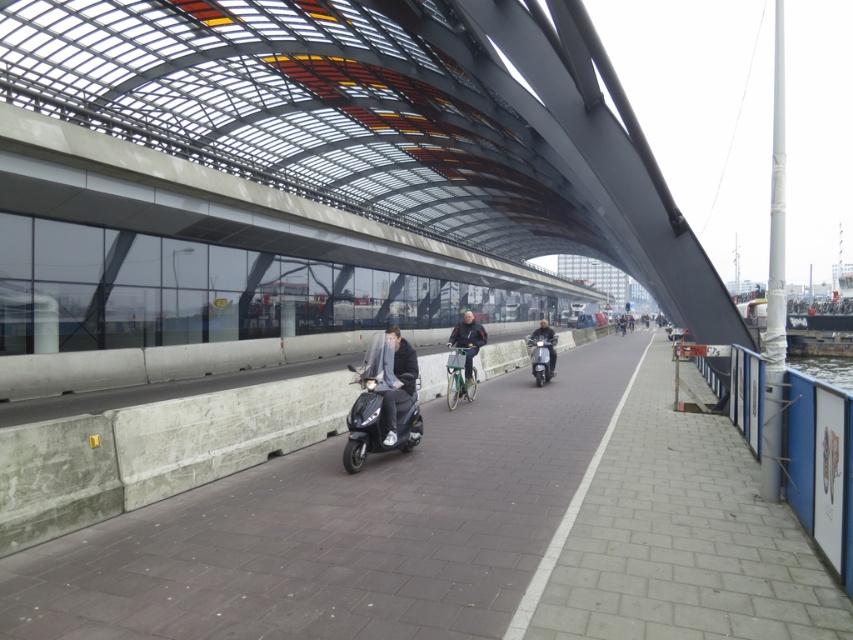
You are a delivery person trying to park your matte black scooter at center on the smooth concrete sidewalk at center. Can you park it there if the sidewalk is wide enough to accommodate the scooter?

The smooth concrete sidewalk at center might be wider than matte black scooter at center, so there is a possibility that the sidewalk is wide enough to park the scooter.

You are a delivery person trying to park your matte black scooter at center on the smooth concrete sidewalk at center. Can the scooter fit on the sidewalk?

The smooth concrete sidewalk at center is smaller than the matte black scooter at center, so the scooter cannot fit on the sidewalk.